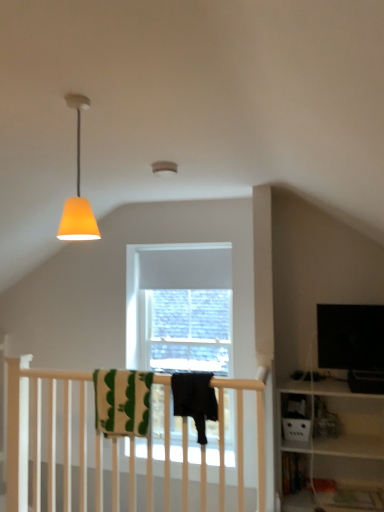
What is the approximate width of orange matte lampshade at upper left?

7.04 inches.

The height and width of the screenshot is (512, 384). In order to click on green striped towel at center, which is counted as the second beach towel, starting from the right in this screenshot , I will do `click(122, 401)`.

Does orange matte lampshade at upper left have a smaller size compared to black cotton towel at center, placed as the 2th beach towel when sorted from left to right?

Yes, orange matte lampshade at upper left is smaller than black cotton towel at center, placed as the 2th beach towel when sorted from left to right.

From a real-world perspective, is orange matte lampshade at upper left positioned above or below black cotton towel at center, acting as the 1th beach towel starting from the right?

From a real-world perspective, orange matte lampshade at upper left is physically above black cotton towel at center, acting as the 1th beach towel starting from the right.

Can you see orange matte lampshade at upper left touching black cotton towel at center, placed as the 2th beach towel when sorted from left to right?

No, orange matte lampshade at upper left is not beside black cotton towel at center, placed as the 2th beach towel when sorted from left to right.

From a real-world perspective, which beach towel is the 1st one underneath the orange matte lampshade at upper left? Please provide its 2D coordinates.

[(194, 399)]

From the image's perspective, who appears lower, black cotton towel at center, acting as the 1th beach towel starting from the right, or green striped towel at center, the 1th beach towel in the left-to-right sequence?

green striped towel at center, the 1th beach towel in the left-to-right sequence, from the image's perspective.

Is point (196, 376) closer or farther from the camera than point (101, 383)?

Point (196, 376).

Is the depth of black cotton towel at center, acting as the 1th beach towel starting from the right, less than that of green striped towel at center, which is counted as the second beach towel, starting from the right?

That is True.

Could green striped towel at center, which is counted as the second beach towel, starting from the right, be considered to be inside black cotton towel at center, acting as the 1th beach towel starting from the right?

No, green striped towel at center, which is counted as the second beach towel, starting from the right, is not inside black cotton towel at center, acting as the 1th beach towel starting from the right.

From the image's perspective, is green striped towel at center, the 1th beach towel in the left-to-right sequence, positioned above or below black cotton towel at center, placed as the 2th beach towel when sorted from left to right?

Based on their image positions, green striped towel at center, the 1th beach towel in the left-to-right sequence, is located beneath black cotton towel at center, placed as the 2th beach towel when sorted from left to right.

From the picture: From a real-world perspective, who is located higher, green striped towel at center, the 1th beach towel in the left-to-right sequence, or black cotton towel at center, acting as the 1th beach towel starting from the right?

black cotton towel at center, acting as the 1th beach towel starting from the right, from a real-world perspective.

Considering the relative positions of green striped towel at center, the 1th beach towel in the left-to-right sequence, and black cotton towel at center, acting as the 1th beach towel starting from the right, in the image provided, is green striped towel at center, the 1th beach towel in the left-to-right sequence, behind black cotton towel at center, acting as the 1th beach towel starting from the right,?

Yes, it is behind black cotton towel at center, acting as the 1th beach towel starting from the right.

Considering the positions of point (195, 392) and point (69, 224), is point (195, 392) closer or farther from the camera than point (69, 224)?

Clearly, point (195, 392) is more distant from the camera than point (69, 224).

From a real-world perspective, who is located higher, black cotton towel at center, acting as the 1th beach towel starting from the right, or orange matte lampshade at upper left?

In real-world perspective, orange matte lampshade at upper left is above.

Starting from the orange matte lampshade at upper left, which beach towel is the 1st one behind? Please provide its 2D coordinates.

[(194, 399)]

Does point (64, 218) appear closer or farther from the camera than point (125, 407)?

Point (64, 218) appears to be closer to the viewer than point (125, 407).

Considering the sizes of objects orange matte lampshade at upper left and green striped towel at center, which is counted as the second beach towel, starting from the right, in the image provided, who is wider, orange matte lampshade at upper left or green striped towel at center, which is counted as the second beach towel, starting from the right,?

With larger width is green striped towel at center, which is counted as the second beach towel, starting from the right.

From their relative heights in the image, would you say orange matte lampshade at upper left is taller or shorter than green striped towel at center, which is counted as the second beach towel, starting from the right?

Clearly, orange matte lampshade at upper left is taller compared to green striped towel at center, which is counted as the second beach towel, starting from the right.

Does orange matte lampshade at upper left have a smaller size compared to green striped towel at center, which is counted as the second beach towel, starting from the right?

Indeed, orange matte lampshade at upper left has a smaller size compared to green striped towel at center, which is counted as the second beach towel, starting from the right.

Looking at this image, from a real-world perspective, who is located lower, green striped towel at center, which is counted as the second beach towel, starting from the right, or orange matte lampshade at upper left?

green striped towel at center, which is counted as the second beach towel, starting from the right, from a real-world perspective.

Who is smaller, green striped towel at center, which is counted as the second beach towel, starting from the right, or orange matte lampshade at upper left?

orange matte lampshade at upper left is smaller.

This screenshot has height=512, width=384. In order to click on lamp that appears above the green striped towel at center, which is counted as the second beach towel, starting from the right (from the image's perspective) in this screenshot , I will do `click(78, 192)`.

How far apart are green striped towel at center, the 1th beach towel in the left-to-right sequence, and orange matte lampshade at upper left?

A distance of 4.21 feet exists between green striped towel at center, the 1th beach towel in the left-to-right sequence, and orange matte lampshade at upper left.

Where is `lamp above the black cotton towel at center, acting as the 1th beach towel starting from the right (from a real-world perspective)`? lamp above the black cotton towel at center, acting as the 1th beach towel starting from the right (from a real-world perspective) is located at coordinates (78, 192).

This screenshot has width=384, height=512. Find the location of `beach towel that appears in front of the green striped towel at center, which is counted as the second beach towel, starting from the right`. beach towel that appears in front of the green striped towel at center, which is counted as the second beach towel, starting from the right is located at coordinates click(x=194, y=399).

When comparing their distances from orange matte lampshade at upper left, does green striped towel at center, the 1th beach towel in the left-to-right sequence, or black cotton towel at center, placed as the 2th beach towel when sorted from left to right, seem further?

The object further to orange matte lampshade at upper left is green striped towel at center, the 1th beach towel in the left-to-right sequence.

Considering their positions, is green striped towel at center, the 1th beach towel in the left-to-right sequence, positioned further to black cotton towel at center, placed as the 2th beach towel when sorted from left to right, than orange matte lampshade at upper left?

orange matte lampshade at upper left is further to black cotton towel at center, placed as the 2th beach towel when sorted from left to right.

Estimate the real-world distances between objects in this image. Which object is closer to black cotton towel at center, acting as the 1th beach towel starting from the right, orange matte lampshade at upper left or green striped towel at center, which is counted as the second beach towel, starting from the right?

green striped towel at center, which is counted as the second beach towel, starting from the right.

Estimate the real-world distances between objects in this image. Which object is further from orange matte lampshade at upper left, black cotton towel at center, acting as the 1th beach towel starting from the right, or green striped towel at center, the 1th beach towel in the left-to-right sequence?

green striped towel at center, the 1th beach towel in the left-to-right sequence, is positioned further to the anchor orange matte lampshade at upper left.

Which object lies further to the anchor point green striped towel at center, which is counted as the second beach towel, starting from the right, orange matte lampshade at upper left or black cotton towel at center, acting as the 1th beach towel starting from the right?

The object further to green striped towel at center, which is counted as the second beach towel, starting from the right, is orange matte lampshade at upper left.

Looking at this image, estimate the real-world distances between objects in this image. Which object is closer to green striped towel at center, which is counted as the second beach towel, starting from the right, black cotton towel at center, placed as the 2th beach towel when sorted from left to right, or orange matte lampshade at upper left?

Based on the image, black cotton towel at center, placed as the 2th beach towel when sorted from left to right, appears to be nearer to green striped towel at center, which is counted as the second beach towel, starting from the right.

Find the location of a particular element. The height and width of the screenshot is (512, 384). beach towel between orange matte lampshade at upper left and green striped towel at center, which is counted as the second beach towel, starting from the right, vertically is located at coordinates (194, 399).